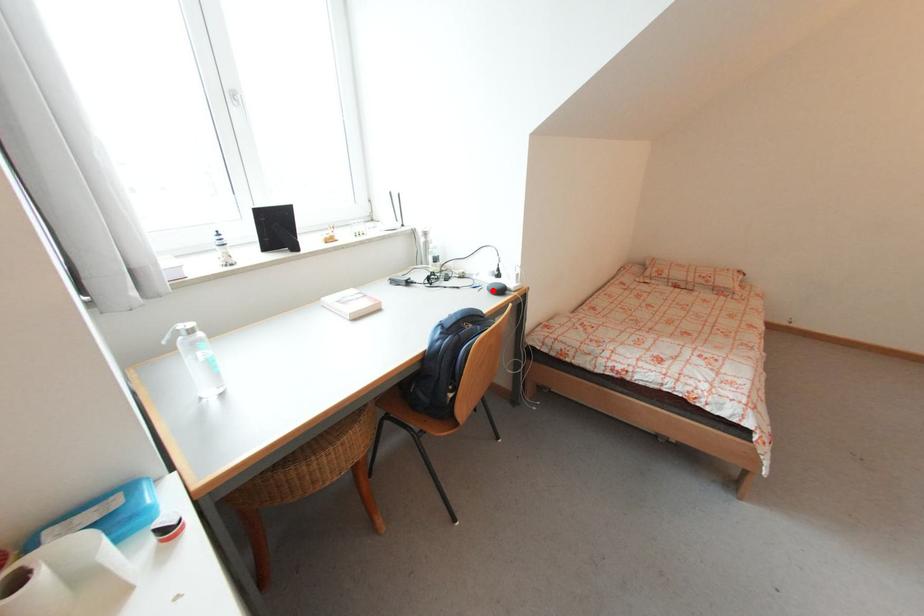
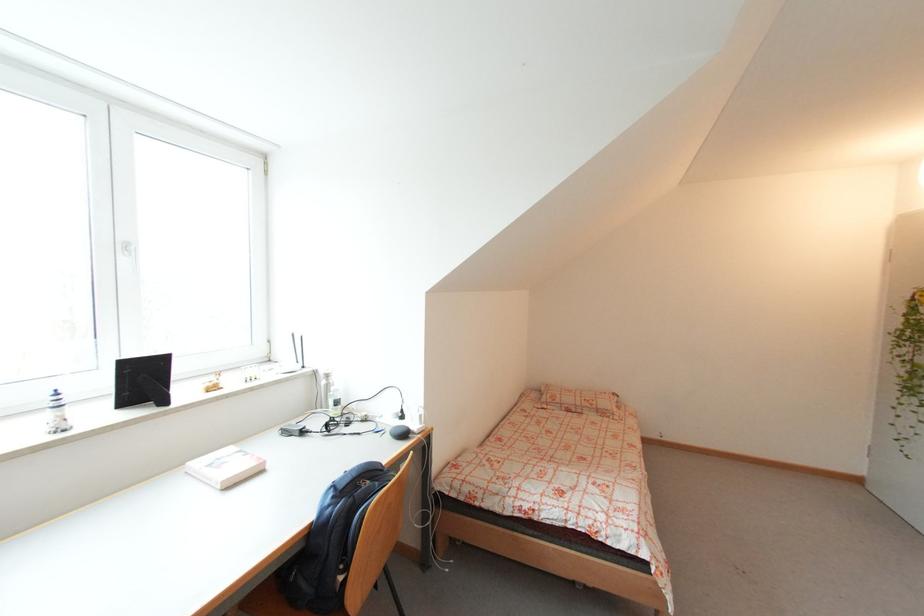
In the second image, find the point that corresponds to the highlighted location in the first image.

(395, 435)